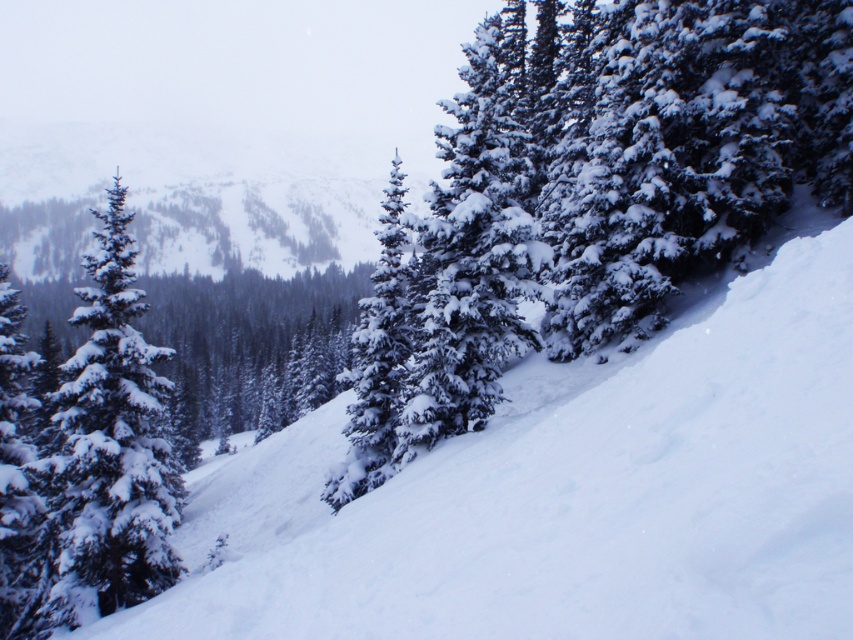
Is point (660, 378) less distant than point (154, 346)?

Yes, it is in front of point (154, 346).

At what (x,y) coordinates should I click in order to perform the action: click on white snow at center. Please return your answer as a coordinate pair (x, y). The image size is (853, 640). Looking at the image, I should click on (567, 493).

Is white snow at center above snow-covered evergreen tree at center?

Actually, white snow at center is below snow-covered evergreen tree at center.

Does white snow at center appear under snow-covered evergreen tree at center?

Yes, white snow at center is below snow-covered evergreen tree at center.

The width and height of the screenshot is (853, 640). What do you see at coordinates (567, 493) in the screenshot? I see `white snow at center` at bounding box center [567, 493].

Where is `white snow at center`? Image resolution: width=853 pixels, height=640 pixels. white snow at center is located at coordinates (567, 493).

Is snow-covered evergreen tree at center taller than snow-covered evergreen at left?

Correct, snow-covered evergreen tree at center is much taller as snow-covered evergreen at left.

Who is more distant from viewer, (764, 26) or (129, 410)?

Positioned behind is point (129, 410).

You are a GUI agent. You are given a task and a screenshot of the screen. Output one action in this format:
    pyautogui.click(x=<x>, y=<y>)
    Task: Click on the snow-covered evergreen tree at center
    The image size is (853, 640).
    Given the screenshot: What is the action you would take?
    pyautogui.click(x=606, y=182)